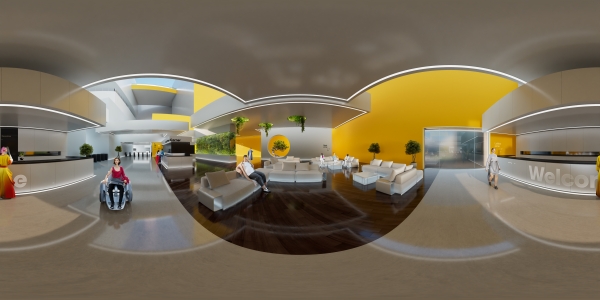
You are a GUI agent. You are given a task and a screenshot of the screen. Output one action in this format:
    pyautogui.click(x=<x>, y=<y>)
    Task: Click on the ceiling
    This screenshot has width=600, height=300.
    Given the screenshot: What is the action you would take?
    pyautogui.click(x=437, y=33)